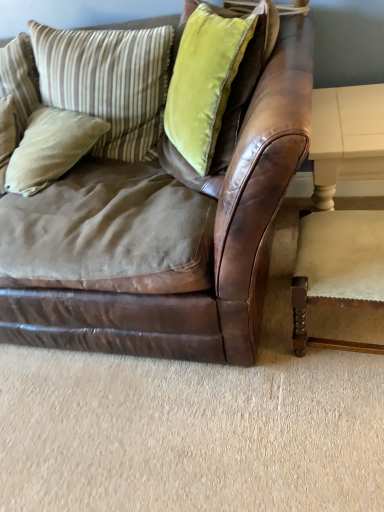
This screenshot has height=512, width=384. What are the coordinates of `free point above beige fabric chair at lower right (from a real-world perspective)` in the screenshot? It's located at (355, 246).